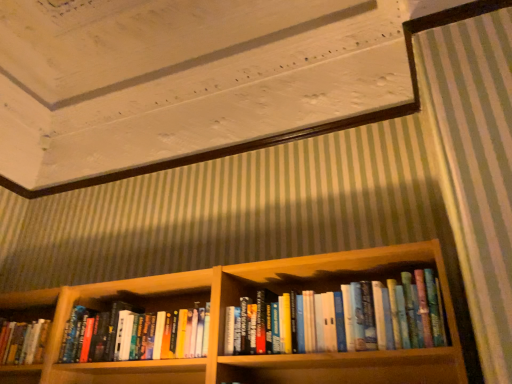
The height and width of the screenshot is (384, 512). What are the coordinates of `wooden bookshelf at center` in the screenshot? It's located at (115, 296).

This screenshot has width=512, height=384. In order to click on wooden bookshelf at lower left in this screenshot , I will do `click(29, 300)`.

Measure the distance between wooden bookshelf at lower left and camera.

wooden bookshelf at lower left is 6.14 feet from camera.

Where is `hardcover books at center`? Image resolution: width=512 pixels, height=384 pixels. hardcover books at center is located at coordinates (374, 316).

Where is `cabinet that is above the wooden bookshelf at lower left (from a real-world perspective)`? cabinet that is above the wooden bookshelf at lower left (from a real-world perspective) is located at coordinates (115, 296).

Could you tell me if wooden bookshelf at center is turned towards wooden bookshelf at lower left?

No, wooden bookshelf at center is not aimed at wooden bookshelf at lower left.

At what (x,y) coordinates should I click in order to perform the action: click on cabinet behind the hardcover books at center. Please return your answer as a coordinate pair (x, y). Looking at the image, I should click on (115, 296).

Are hardcover books at center and wooden bookshelf at center making contact?

They are not placed beside each other.

Is hardcover books at center located outside wooden bookshelf at center?

Absolutely, hardcover books at center is external to wooden bookshelf at center.

Considering their positions, is hardcover books at center located in front of or behind wooden bookshelf at center?

Clearly, hardcover books at center is in front of wooden bookshelf at center.

Can you confirm if hardcover books at center is thinner than wooden bookshelf at lower left?

No, hardcover books at center is not thinner than wooden bookshelf at lower left.

From the picture: Between hardcover books at center and wooden bookshelf at lower left, which one has less height?

wooden bookshelf at lower left.

In the image, is hardcover books at center positioned in front of or behind wooden bookshelf at lower left?

hardcover books at center is in front of wooden bookshelf at lower left.

In the scene shown: From a real-world perspective, is hardcover books at center physically above wooden bookshelf at lower left?

Yes, from a real-world perspective, hardcover books at center is over wooden bookshelf at lower left

Would you say hardcover books at center is part of wooden bookshelf at lower left's contents?

No, hardcover books at center is not inside wooden bookshelf at lower left.

What's the angular difference between wooden bookshelf at lower left and hardcover books at center's facing directions?

There is a 0.000507-degree angle between the facing directions of wooden bookshelf at lower left and hardcover books at center.

Is wooden bookshelf at lower left at the left side of hardcover books at center?

Yes.

This screenshot has width=512, height=384. In order to click on book above the wooden bookshelf at lower left (from a real-world perspective) in this screenshot , I will do `click(374, 316)`.

Between wooden bookshelf at lower left and wooden bookshelf at center, which one appears on the right side from the viewer's perspective?

Positioned to the right is wooden bookshelf at center.

From the image's perspective, is wooden bookshelf at lower left over wooden bookshelf at center?

Actually, wooden bookshelf at lower left appears below wooden bookshelf at center in the image.

Considering the sizes of objects wooden bookshelf at lower left and wooden bookshelf at center in the image provided, who is wider, wooden bookshelf at lower left or wooden bookshelf at center?

wooden bookshelf at center.

From the image's perspective, is wooden bookshelf at center above or below hardcover books at center?

Clearly, from the image's perspective, wooden bookshelf at center is below hardcover books at center.

Can you confirm if wooden bookshelf at center is wider than hardcover books at center?

Yes, wooden bookshelf at center is wider than hardcover books at center.

Identify the location of cabinet above the wooden bookshelf at lower left (from the image's perspective). (115, 296).

At what (x,y) coordinates should I click in order to perform the action: click on cabinet that appears below the hardcover books at center (from the image's perspective). Please return your answer as a coordinate pair (x, y). Looking at the image, I should click on (115, 296).

Considering their positions, is wooden bookshelf at lower left positioned closer to hardcover books at center than wooden bookshelf at center?

wooden bookshelf at center is closer to hardcover books at center.

From the image, which object appears to be farther from hardcover books at center, wooden bookshelf at center or wooden bookshelf at lower left?

wooden bookshelf at lower left is further to hardcover books at center.

When comparing their distances from wooden bookshelf at center, does wooden bookshelf at lower left or hardcover books at center seem closer?

wooden bookshelf at lower left lies closer to wooden bookshelf at center than the other object.

Estimate the real-world distances between objects in this image. Which object is further from wooden bookshelf at center, hardcover books at center or wooden bookshelf at lower left?

Answer: The object further to wooden bookshelf at center is hardcover books at center.

Looking at the image, which one is located further to wooden bookshelf at lower left, wooden bookshelf at center or hardcover books at center?

hardcover books at center lies further to wooden bookshelf at lower left than the other object.

Which object lies nearer to the anchor point wooden bookshelf at lower left, hardcover books at center or wooden bookshelf at center?

Based on the image, wooden bookshelf at center appears to be nearer to wooden bookshelf at lower left.

Where is `cabinet between wooden bookshelf at lower left and hardcover books at center from left to right`? This screenshot has height=384, width=512. cabinet between wooden bookshelf at lower left and hardcover books at center from left to right is located at coordinates (115, 296).